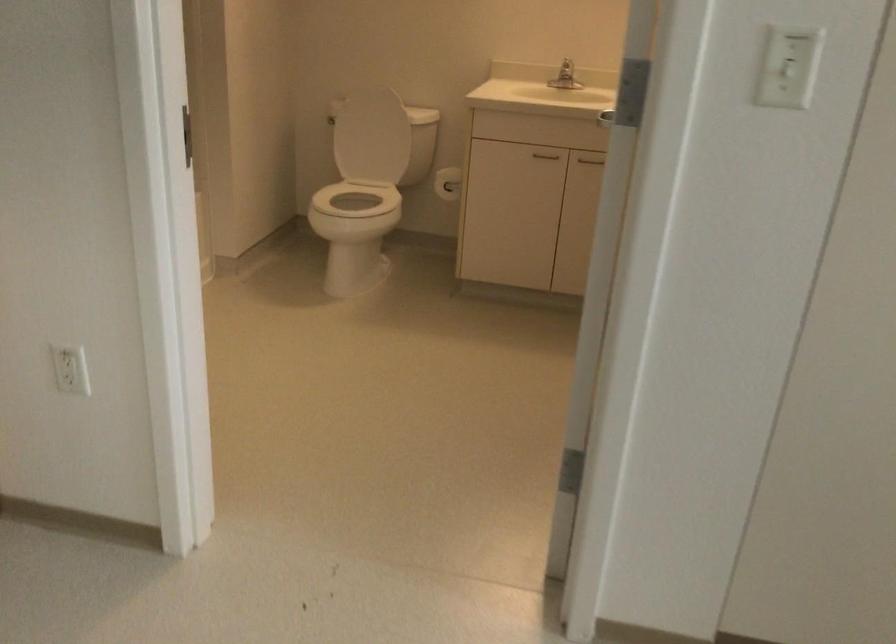
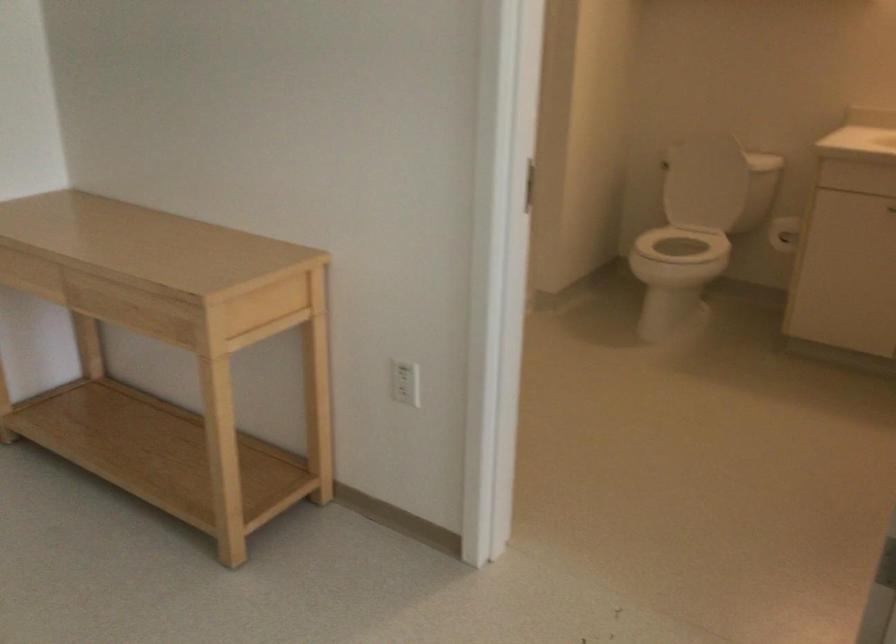
Question: In a continuous first-person perspective shot, in which direction is the camera moving?

Choices:
 (A) Left
 (B) Right
 (C) Forward
 (D) Backward

Answer: (D)